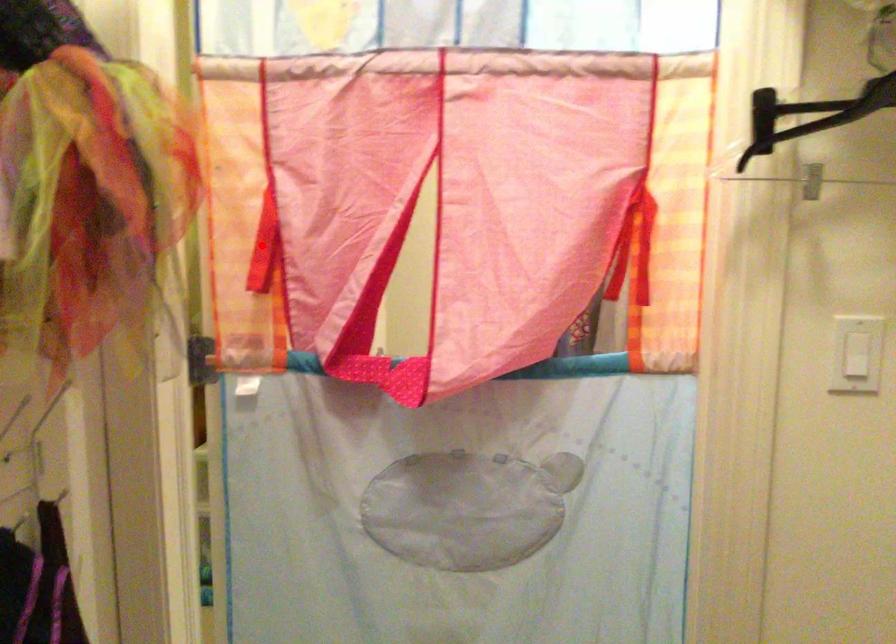
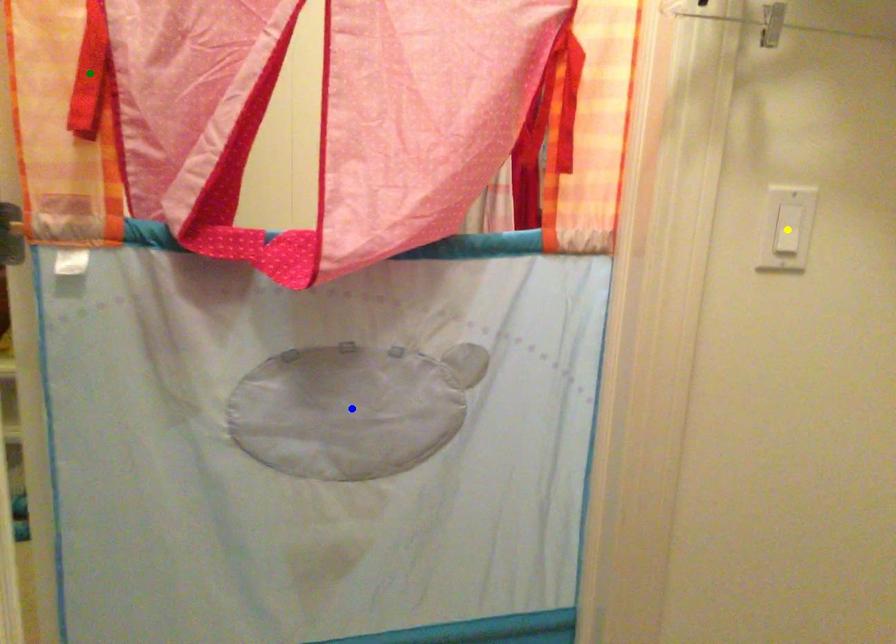
Question: I am providing you with two images of the same scene from different viewpoints. A red point is marked on the first image. You are given multiple points on the second image. Which mark in image 2 goes with the point in image 1?

Choices:
 (A) yellow point
 (B) blue point
 (C) green point

Answer: (C)